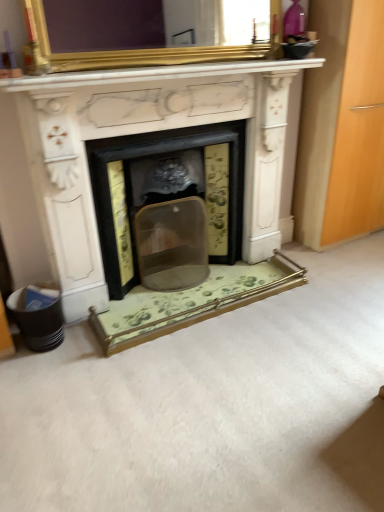
In order to face white marble fireplace at center, should I rotate leftwards or rightwards?

To face it directly, rotate left by 2.918 degrees.

At what (x,y) coordinates should I click in order to perform the action: click on white marble fireplace at center. Please return your answer as a coordinate pair (x, y). The height and width of the screenshot is (512, 384). Looking at the image, I should click on (146, 132).

From the picture: What is the approximate width of white marble fireplace at center?

It is 44.65 centimeters.

This screenshot has width=384, height=512. What do you see at coordinates (146, 132) in the screenshot?
I see `white marble fireplace at center` at bounding box center [146, 132].

What are the coordinates of `white marble fireplace at center` in the screenshot? It's located at (146, 132).